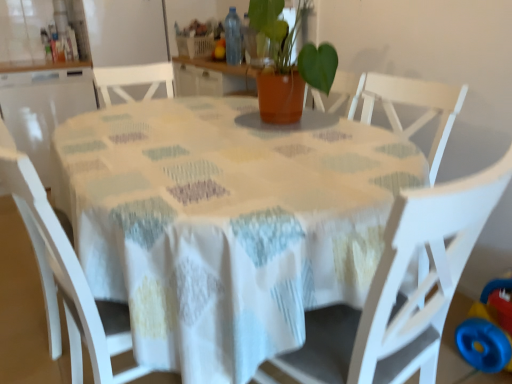
Identify the location of vacant area that lies in front of terracotta pot at center. This screenshot has height=384, width=512. (279, 140).